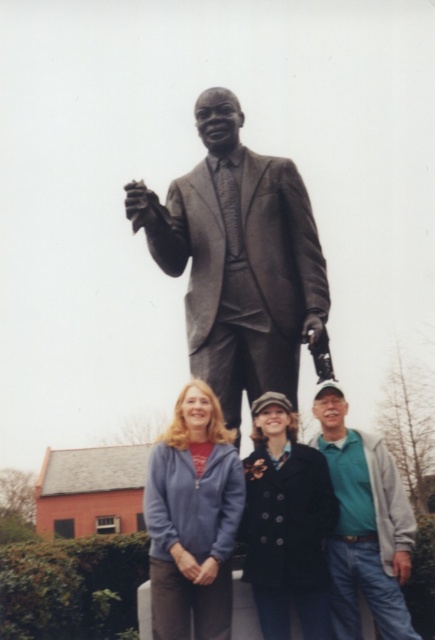
In the image, there are three people standing in front of a statue. The person on the left is wearing a blue zip up jacket over a red shirt. The person in the center is wearing a dark coat with floral. What is the color and material of the coat worn by the person at the point marked by coordinates [285,524]?

The dark blue wool coat at center is represented by point [285,524], so the coat is dark blue in color and made of wool.